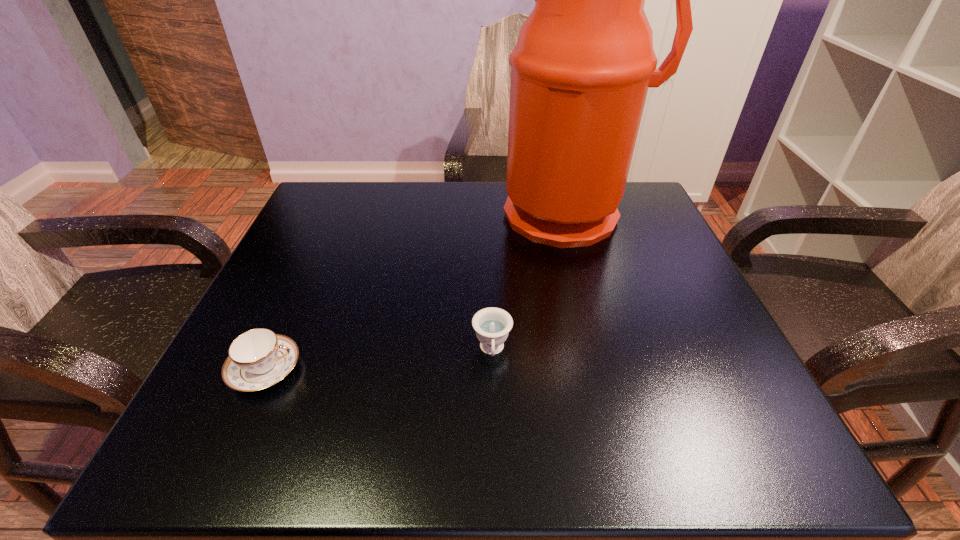
At what (x,y) coordinates should I click in order to perform the action: click on vacant space that satisfies the following two spatial constraints: 1. on the side of the right teacup with the handle; 2. on the side with the handle of the left teacup. Please return your answer as a coordinate pair (x, y). The height and width of the screenshot is (540, 960). Looking at the image, I should click on (492, 369).

Identify the location of vacant space that satisfies the following two spatial constraints: 1. on the side of the right teacup with the handle; 2. on the side with the handle of the left teacup. Image resolution: width=960 pixels, height=540 pixels. (492, 369).

Find the location of `vacant space that satisfies the following two spatial constraints: 1. on the side of the right teacup with the handle; 2. on the side with the handle of the leftmost object`. vacant space that satisfies the following two spatial constraints: 1. on the side of the right teacup with the handle; 2. on the side with the handle of the leftmost object is located at coordinates (492, 369).

You are a GUI agent. You are given a task and a screenshot of the screen. Output one action in this format:
    pyautogui.click(x=<x>, y=<y>)
    Task: Click on the free spot that satisfies the following two spatial constraints: 1. on the side of the right teacup with the handle; 2. on the side with the handle of the left teacup
    
    Given the screenshot: What is the action you would take?
    coord(492,369)

Identify the location of blank area in the image that satisfies the following two spatial constraints: 1. on the side of the right teacup with the handle; 2. on the side with the handle of the left teacup. (492, 369).